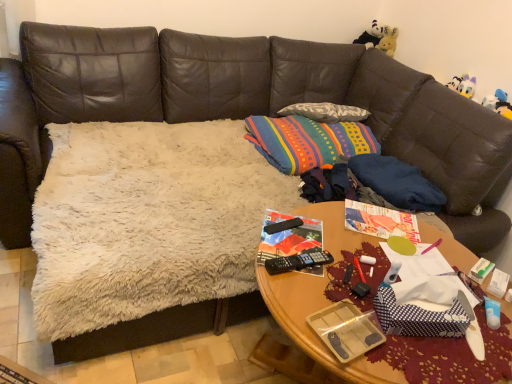
Identify the location of free space that is in between clear plastic tray at center and blue dotted paper at center. 390,344.